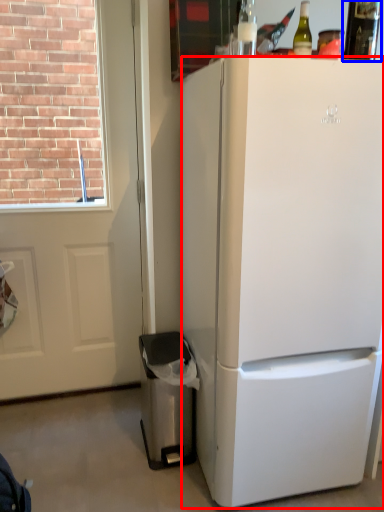
Question: Which object appears closest to the camera in this image, refrigerator (highlighted by a red box) or bottle (highlighted by a blue box)?

Choices:
 (A) refrigerator
 (B) bottle

Answer: (A)